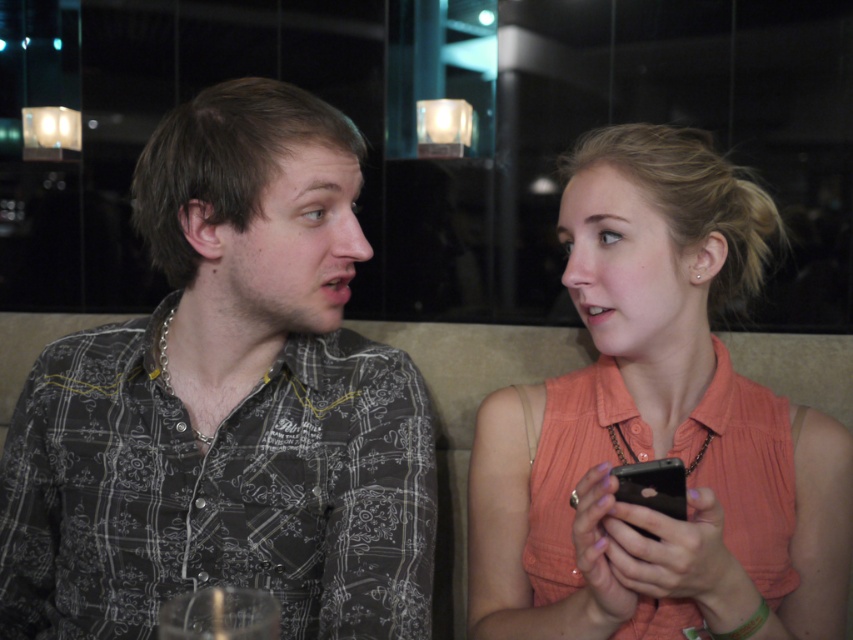
Question: Which of the following is the farthest from the observer?

Choices:
 (A) black matte smartphone at lower right
 (B) matte peach sleeveless top at right
 (C) dark gray printed shirt at left

Answer: (C)

Question: Among these objects, which one is farthest from the camera?

Choices:
 (A) dark gray printed shirt at left
 (B) black matte smartphone at lower right

Answer: (A)

Question: Does matte peach sleeveless top at right have a larger size compared to black matte smartphone at lower right?

Choices:
 (A) no
 (B) yes

Answer: (B)

Question: Which of the following is the farthest from the observer?

Choices:
 (A) dark gray printed shirt at left
 (B) matte peach sleeveless top at right
 (C) black matte smartphone at lower right

Answer: (A)

Question: Is dark gray printed shirt at left bigger than black matte smartphone at lower right?

Choices:
 (A) yes
 (B) no

Answer: (A)

Question: Does dark gray printed shirt at left come in front of black matte smartphone at lower right?

Choices:
 (A) no
 (B) yes

Answer: (A)